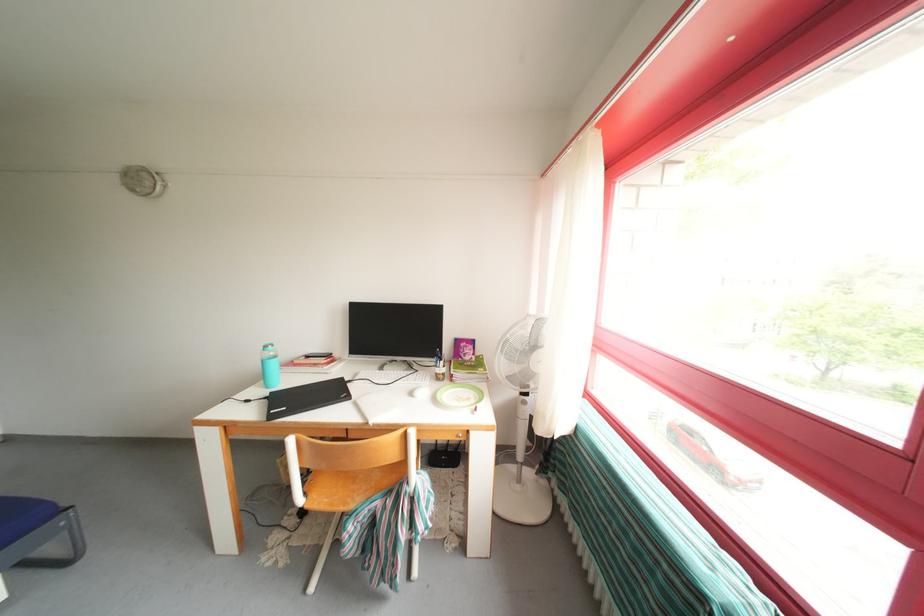
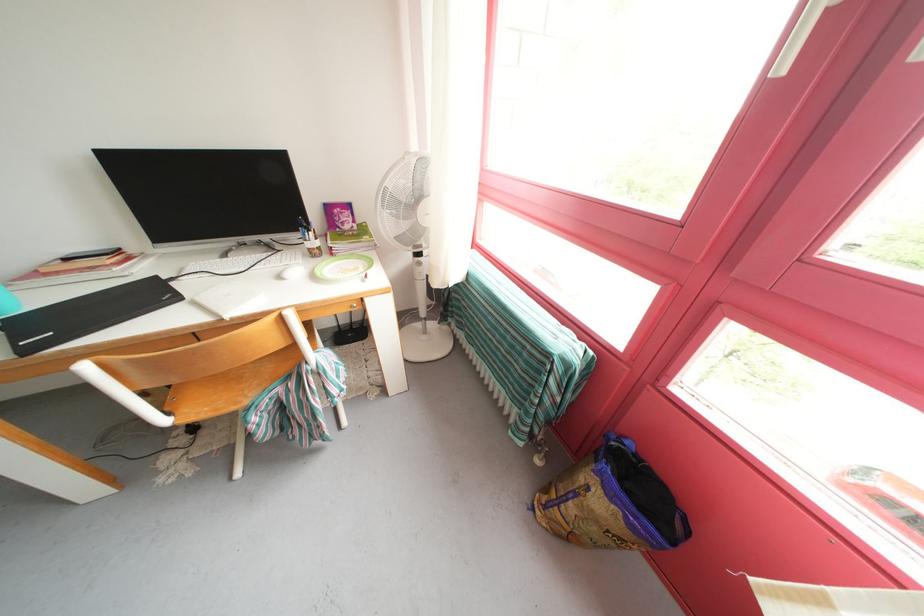
The point at [321,501] is marked in the first image. Where is the corresponding point in the second image?

(191, 416)